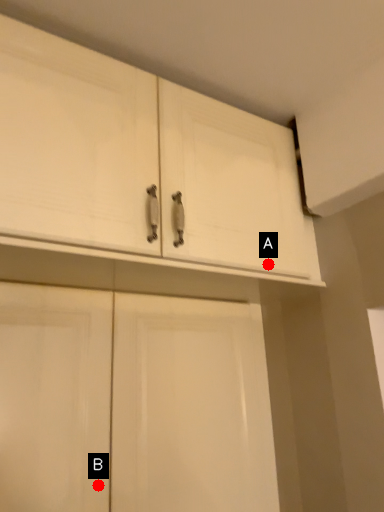
Question: Two points are circled on the image, labeled by A and B beside each circle. Which point is farther from the camera taking this photo?

Choices:
 (A) A is further
 (B) B is further

Answer: (A)